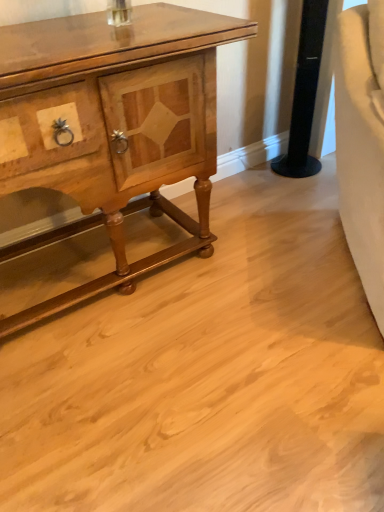
Image resolution: width=384 pixels, height=512 pixels. I want to click on vacant space to the left of black glossy speaker at upper right, so click(255, 179).